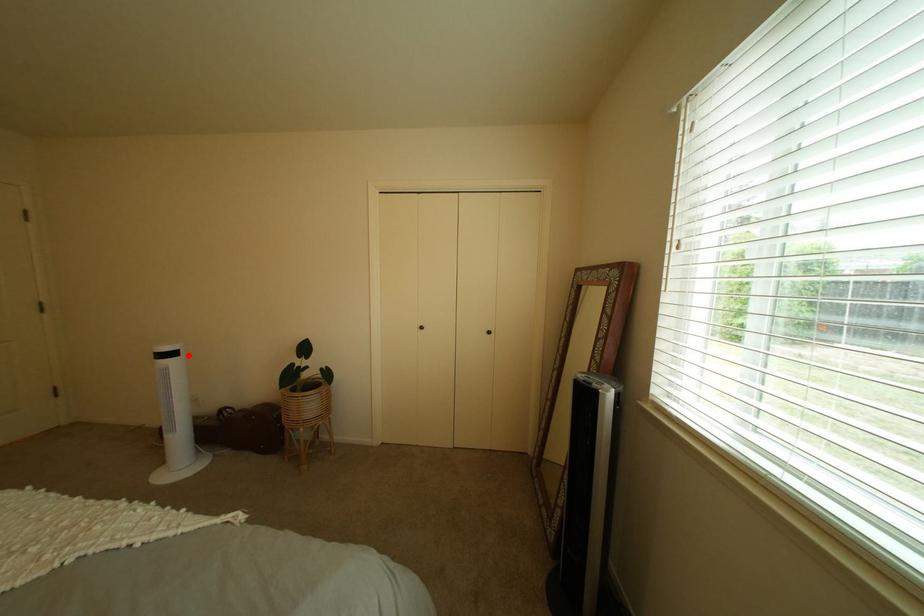
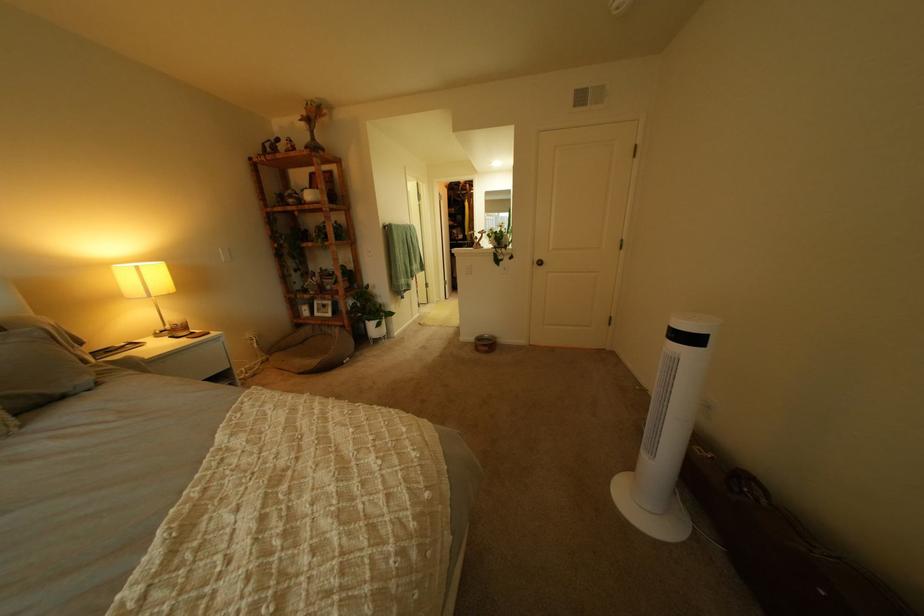
Locate, in the second image, the point that corresponds to the highlighted location in the first image.

(710, 341)